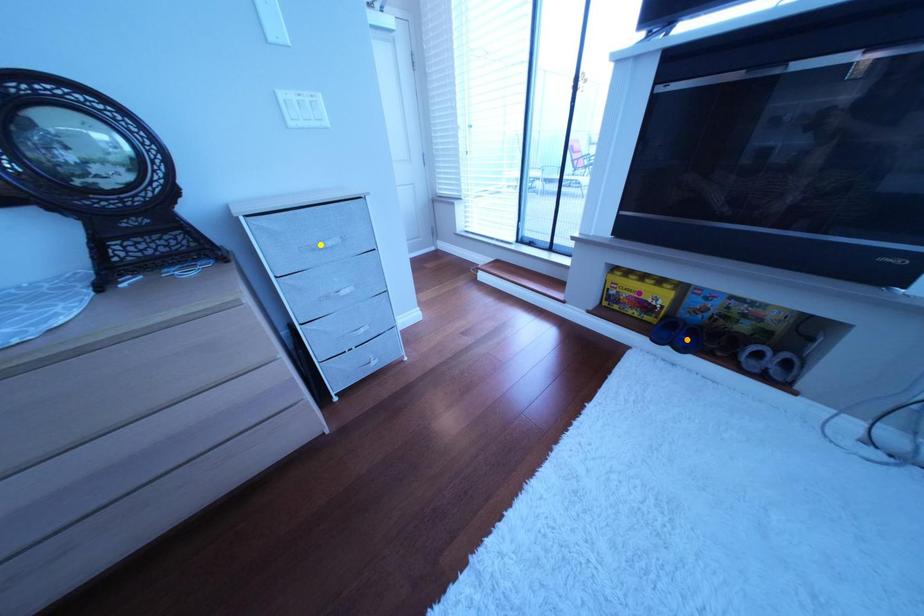
Order these from nearest to farthest:
A) yellow point
B) orange point
C) purple point

yellow point, orange point, purple point